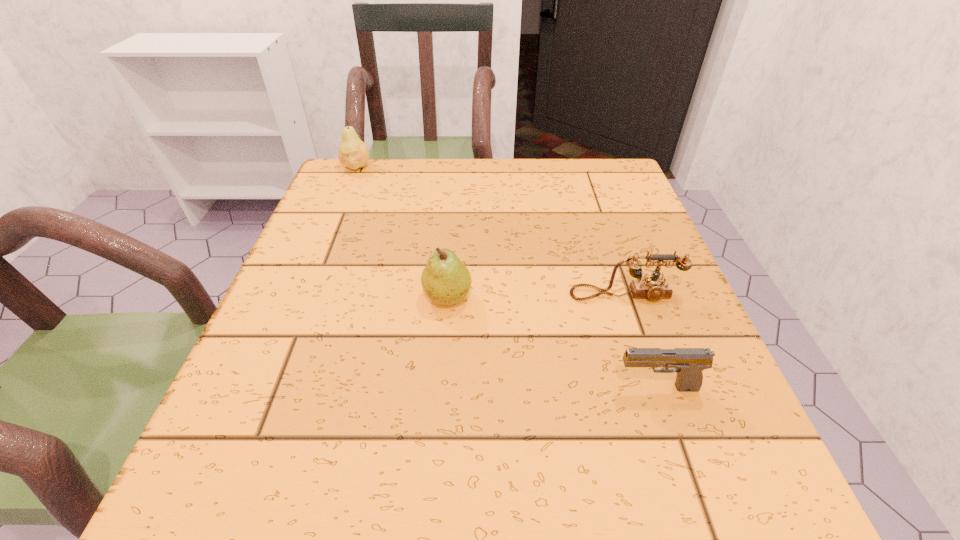
Locate an element on the screen. The image size is (960, 540). vacant space located aim along the barrel of the nearest object is located at coordinates (494, 388).

This screenshot has height=540, width=960. I want to click on vacant area located aim along the barrel of the nearest object, so click(x=482, y=388).

Locate an element on the screen. object present at the far edge is located at coordinates tap(352, 152).

This screenshot has width=960, height=540. I want to click on object at the left edge, so click(x=352, y=152).

Locate an element on the screen. The height and width of the screenshot is (540, 960). telephone at the right edge is located at coordinates (652, 287).

Find the location of a particular element. The width and height of the screenshot is (960, 540). pistol located at the right edge is located at coordinates (688, 363).

In order to click on object present at the far left corner in this screenshot , I will do [352, 152].

What are the coordinates of `vacant space at the far edge` in the screenshot? It's located at (500, 166).

Where is `vacant area at the near edge`? Image resolution: width=960 pixels, height=540 pixels. vacant area at the near edge is located at coordinates coord(453,483).

The width and height of the screenshot is (960, 540). In the image, there is a desktop. In order to click on vacant space at the right edge in this screenshot , I will do (x=696, y=344).